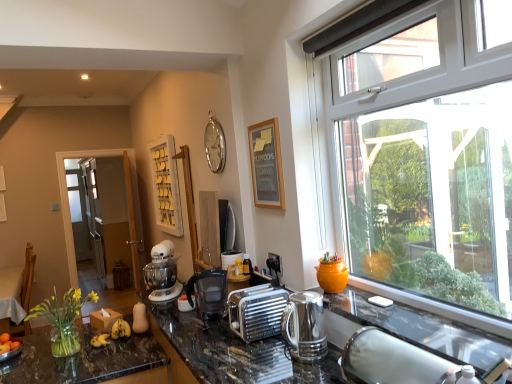
The image size is (512, 384). I want to click on blank space to the left of polished stainless steel kettle at lower right, which is the second coffee machine from back to front, so click(x=263, y=359).